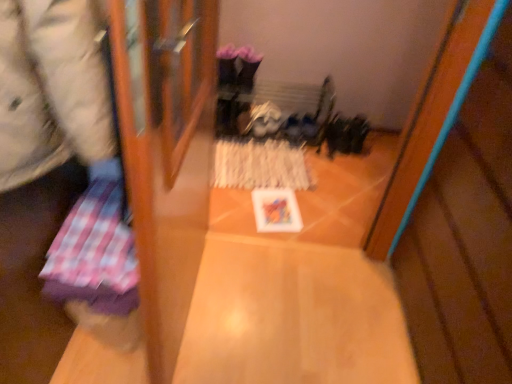
Question: Does white textured paper at center, positioned as the first wrapping paper in back-to-front order, have a lesser height compared to plaid fabric at left?

Choices:
 (A) yes
 (B) no

Answer: (A)

Question: Can you confirm if white textured paper at center, the 1th wrapping paper viewed from the right, is positioned to the left of plaid fabric at left?

Choices:
 (A) no
 (B) yes

Answer: (A)

Question: Is white textured paper at center, placed as the second wrapping paper when sorted from bottom to top, oriented towards plaid fabric at left?

Choices:
 (A) no
 (B) yes

Answer: (A)

Question: From the image's perspective, is white textured paper at center, the 2th wrapping paper from the front, under plaid fabric at left?

Choices:
 (A) no
 (B) yes

Answer: (B)

Question: Is white textured paper at center, which appears as the first wrapping paper when viewed from the top, far away from plaid fabric at left?

Choices:
 (A) yes
 (B) no

Answer: (A)

Question: From a real-world perspective, is white textured paper at center, the 1th wrapping paper viewed from the right, physically above plaid fabric at left?

Choices:
 (A) yes
 (B) no

Answer: (B)

Question: Does plaid fabric at left, placed as the 2th wrapping paper when sorted from right to left, have a greater width compared to plaid fabric at left?

Choices:
 (A) no
 (B) yes

Answer: (B)

Question: Considering the relative sizes of plaid fabric at left, the first wrapping paper ordered from the bottom, and plaid fabric at left in the image provided, is plaid fabric at left, the first wrapping paper ordered from the bottom, shorter than plaid fabric at left?

Choices:
 (A) no
 (B) yes

Answer: (B)

Question: Can you confirm if plaid fabric at left, placed as the second wrapping paper when sorted from top to bottom, is smaller than plaid fabric at left?

Choices:
 (A) no
 (B) yes

Answer: (B)

Question: Does plaid fabric at left, placed as the second wrapping paper when sorted from top to bottom, have a lesser width compared to plaid fabric at left?

Choices:
 (A) no
 (B) yes

Answer: (A)

Question: From a real-world perspective, is plaid fabric at left, which appears as the first wrapping paper when viewed from the front, located higher than plaid fabric at left?

Choices:
 (A) yes
 (B) no

Answer: (B)

Question: Considering the relative positions of plaid fabric at left, which appears as the first wrapping paper when viewed from the front, and plaid fabric at left in the image provided, is plaid fabric at left, which appears as the first wrapping paper when viewed from the front, to the left of plaid fabric at left from the viewer's perspective?

Choices:
 (A) no
 (B) yes

Answer: (B)

Question: Is plaid fabric at left, acting as the first wrapping paper starting from the left, surrounding wooden table at center?

Choices:
 (A) yes
 (B) no

Answer: (B)